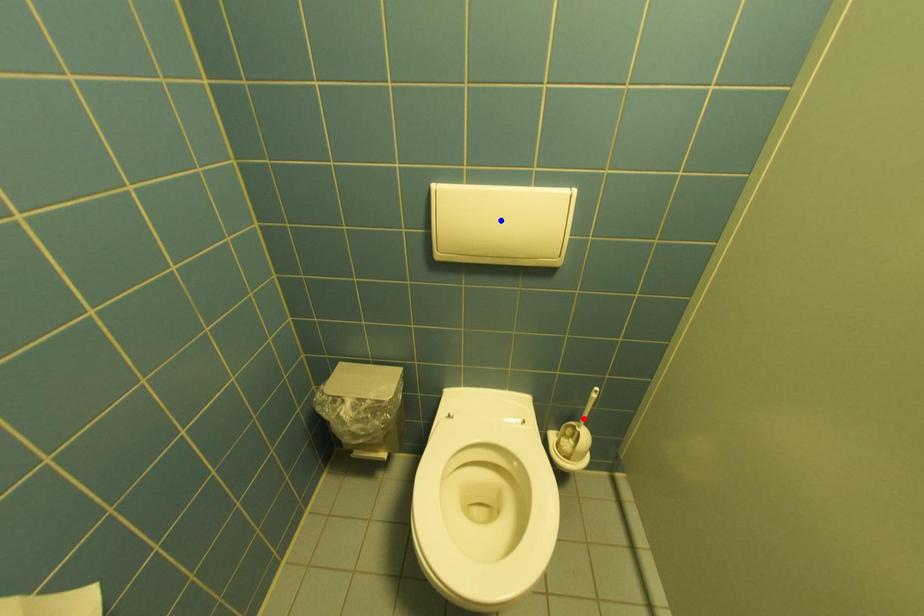
Question: In the image, two points are highlighted. Which point is nearer to the camera? Reply with the corresponding letter.

Choices:
 (A) blue point
 (B) red point

Answer: (A)